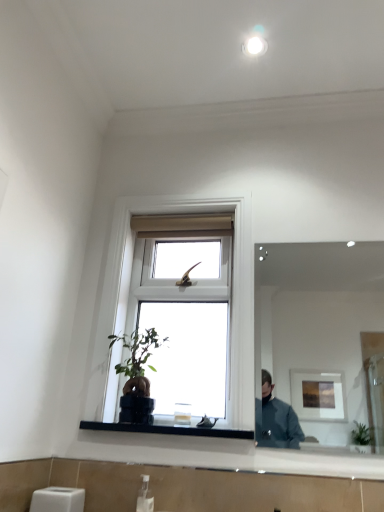
Question: Considering the relative positions of clear glass mirror at upper right and white wood window at center in the image provided, is clear glass mirror at upper right to the left of white wood window at center from the viewer's perspective?

Choices:
 (A) no
 (B) yes

Answer: (A)

Question: Does clear glass mirror at upper right lie behind white wood window at center?

Choices:
 (A) yes
 (B) no

Answer: (B)

Question: Does clear glass mirror at upper right have a lesser height compared to white wood window at center?

Choices:
 (A) yes
 (B) no

Answer: (A)

Question: Considering the relative sizes of clear glass mirror at upper right and white wood window at center in the image provided, is clear glass mirror at upper right wider than white wood window at center?

Choices:
 (A) no
 (B) yes

Answer: (A)

Question: Is clear glass mirror at upper right taller than white wood window at center?

Choices:
 (A) yes
 (B) no

Answer: (B)

Question: From the image's perspective, is white plastic soap dispenser at lower center located above or below white wood window at center?

Choices:
 (A) below
 (B) above

Answer: (A)

Question: From a real-world perspective, is white plastic soap dispenser at lower center physically located above or below white wood window at center?

Choices:
 (A) below
 (B) above

Answer: (A)

Question: Is white plastic soap dispenser at lower center in front of or behind white wood window at center in the image?

Choices:
 (A) front
 (B) behind

Answer: (A)

Question: Looking at the image, does white plastic soap dispenser at lower center seem bigger or smaller compared to white wood window at center?

Choices:
 (A) small
 (B) big

Answer: (A)

Question: Considering the positions of black glass at lower center and clear glass mirror at upper right in the image, is black glass at lower center wider or thinner than clear glass mirror at upper right?

Choices:
 (A) thin
 (B) wide

Answer: (B)

Question: Considering the relative positions of black glass at lower center and clear glass mirror at upper right in the image provided, is black glass at lower center to the left or to the right of clear glass mirror at upper right?

Choices:
 (A) right
 (B) left

Answer: (B)

Question: Is black glass at lower center inside or outside of clear glass mirror at upper right?

Choices:
 (A) outside
 (B) inside

Answer: (A)

Question: Looking at the image, does black glass at lower center seem bigger or smaller compared to clear glass mirror at upper right?

Choices:
 (A) big
 (B) small

Answer: (B)

Question: In terms of width, does white plastic soap dispenser at lower center look wider or thinner when compared to black glass at lower center?

Choices:
 (A) thin
 (B) wide

Answer: (A)

Question: Based on their positions, is white plastic soap dispenser at lower center located to the left or right of black glass at lower center?

Choices:
 (A) right
 (B) left

Answer: (B)